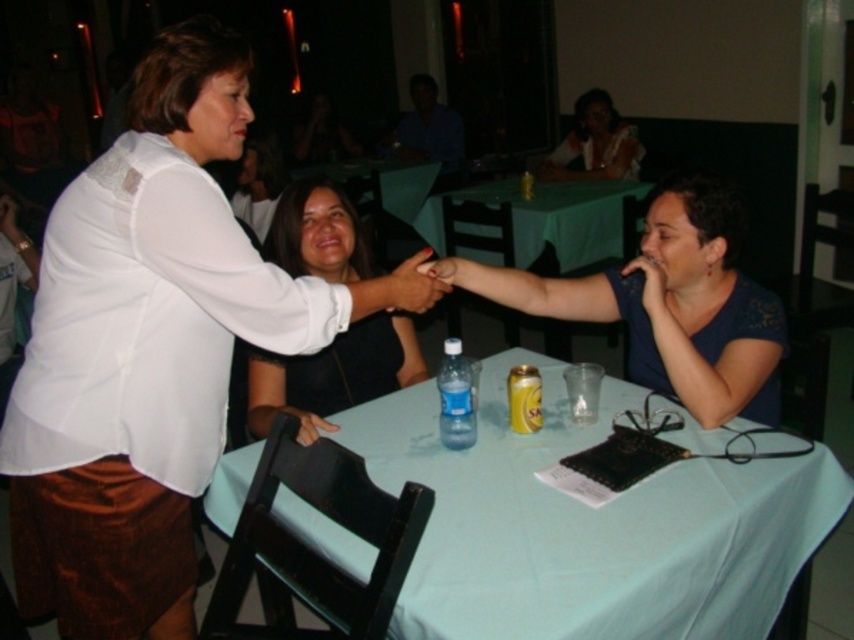
Question: Which object is the closest to the black matte dress at center?

Choices:
 (A) blue shirt at upper center
 (B) green fabric table at center
 (C) light blue fabric table at center

Answer: (C)

Question: Among these objects, which one is farthest from the camera?

Choices:
 (A) white textured blouse at upper center
 (B) green fabric table at center
 (C) black matte dress at center
 (D) white satin blouse at upper left

Answer: (A)

Question: Is white satin blouse at upper left below white matte shirt at upper left?

Choices:
 (A) yes
 (B) no

Answer: (A)

Question: Observing the image, what is the correct spatial positioning of blue fabric table at center in reference to green fabric table at center?

Choices:
 (A) left
 (B) right

Answer: (A)

Question: Does light blue fabric table at center have a larger size compared to matte black hand at center?

Choices:
 (A) no
 (B) yes

Answer: (B)

Question: Considering the real-world distances, which object is farthest from the light blue fabric table at center?

Choices:
 (A) matte black hand at center
 (B) white textured blouse at upper center
 (C) blue fabric table at center
 (D) white satin blouse at upper left

Answer: (B)